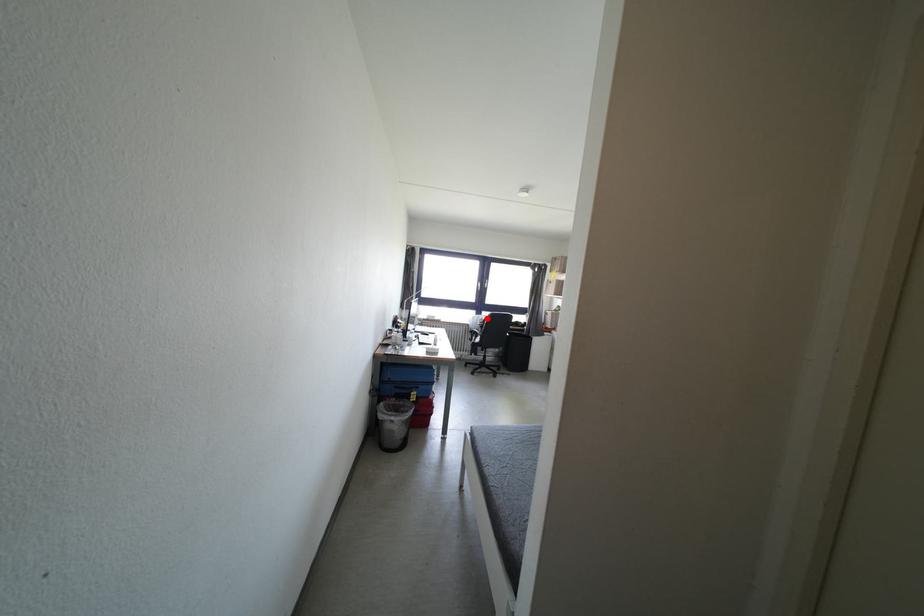
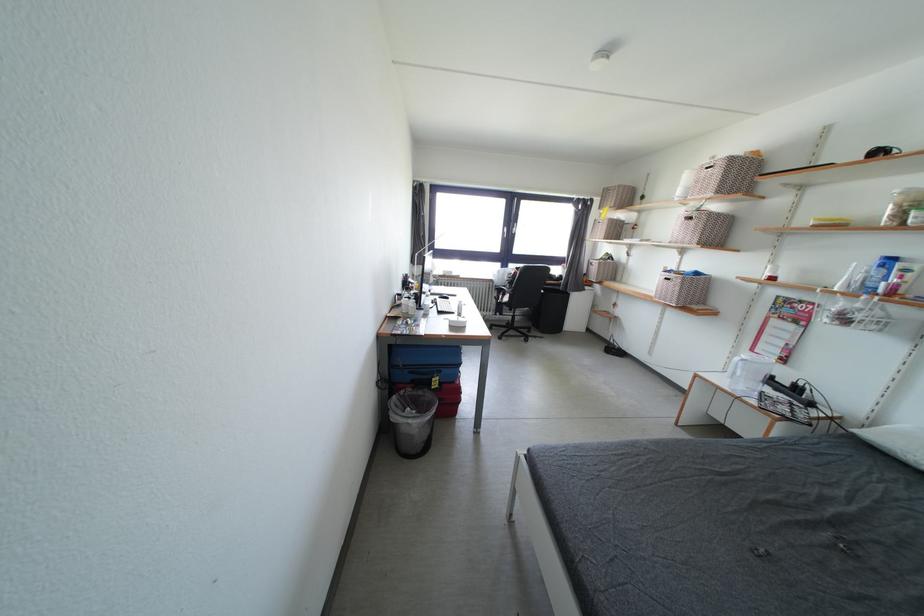
Question: I am providing you with two images of the same scene from different viewpoints. A red point is shown in image1. For the corresponding object point in image2, is it positioned nearer or farther from the camera?

Choices:
 (A) Nearer
 (B) Farther

Answer: (A)